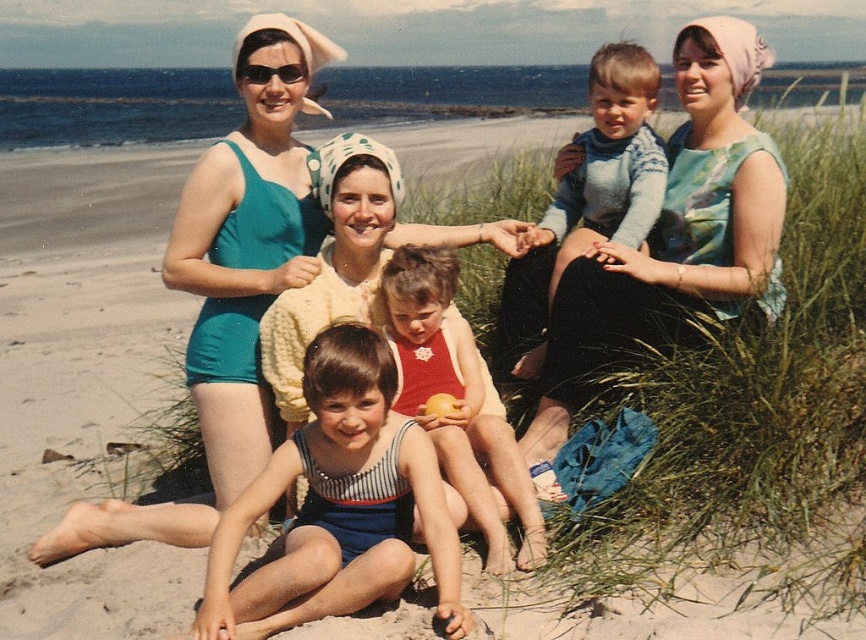
You are a photographer trying to capture a family photo on the beach. You notice the floral dress at center and the knitted sweater at center. How far apart are these two items from each other?

The floral dress at center is 13.28 inches away from the knitted sweater at center.